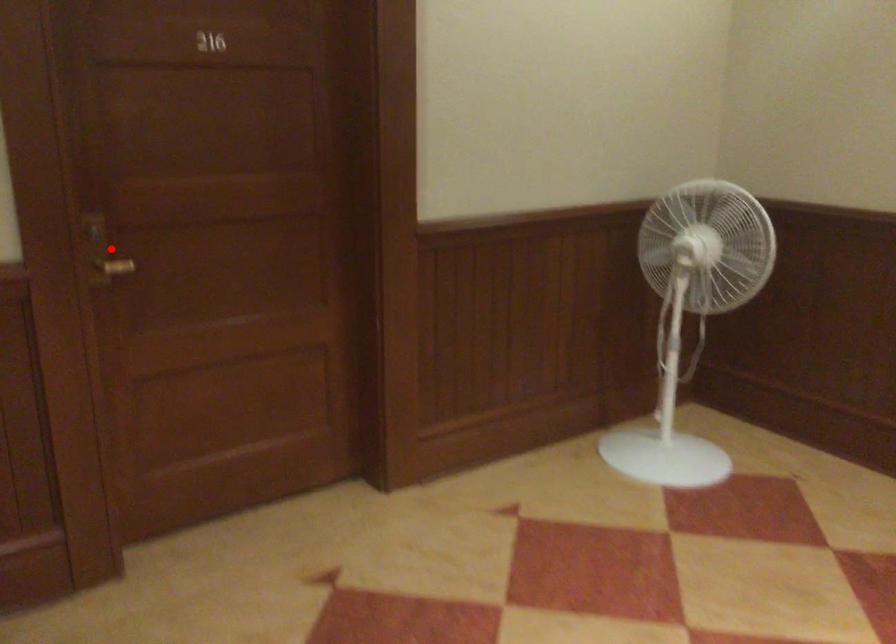
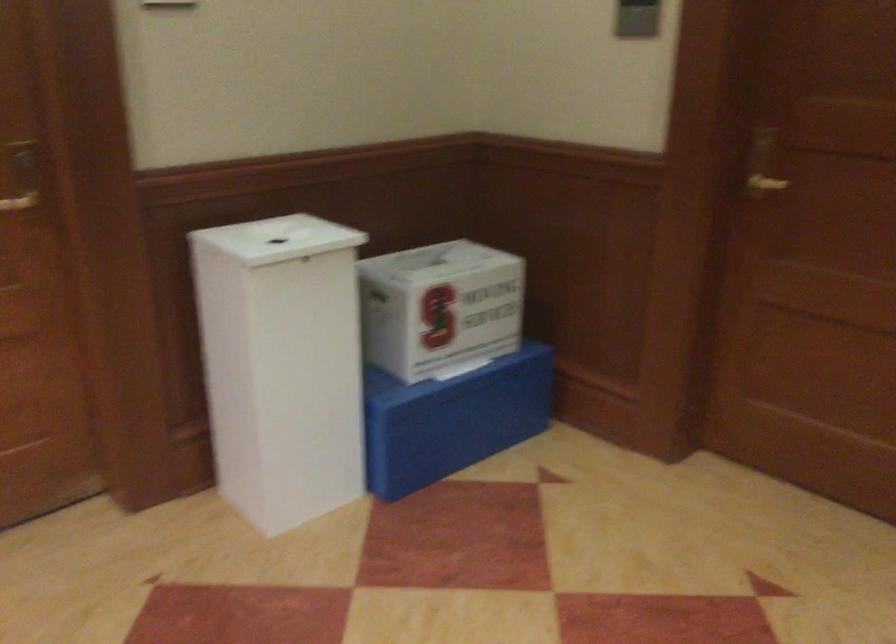
The point at the highlighted location is marked in the first image. Where is the corresponding point in the second image?

(762, 164)